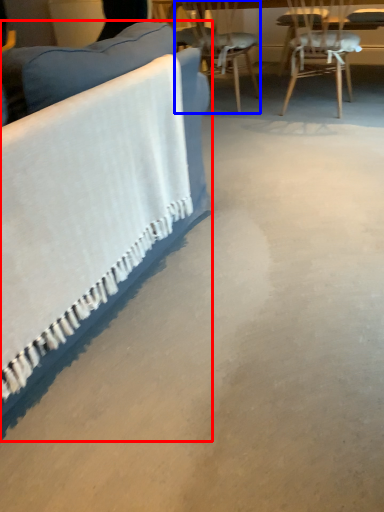
Question: Which point is further to the camera, studio couch (highlighted by a red box) or chair (highlighted by a blue box)?

Choices:
 (A) studio couch
 (B) chair

Answer: (B)